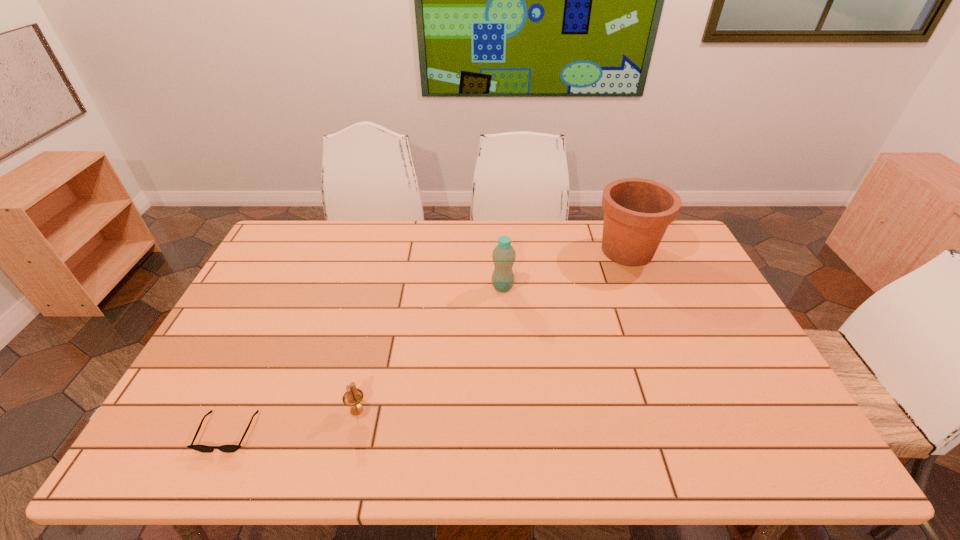
Image resolution: width=960 pixels, height=540 pixels. What are the coordinates of `free space that satisfies the following two spatial constraints: 1. at the front cap of the third nearest object; 2. on the front-facing side of the sunglasses` in the screenshot? It's located at (511, 432).